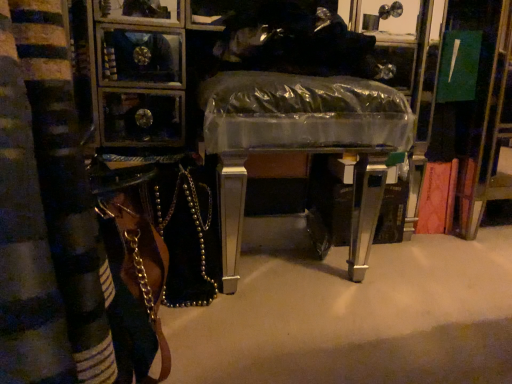
The width and height of the screenshot is (512, 384). I want to click on free space in front of clear plastic table at center, so click(319, 334).